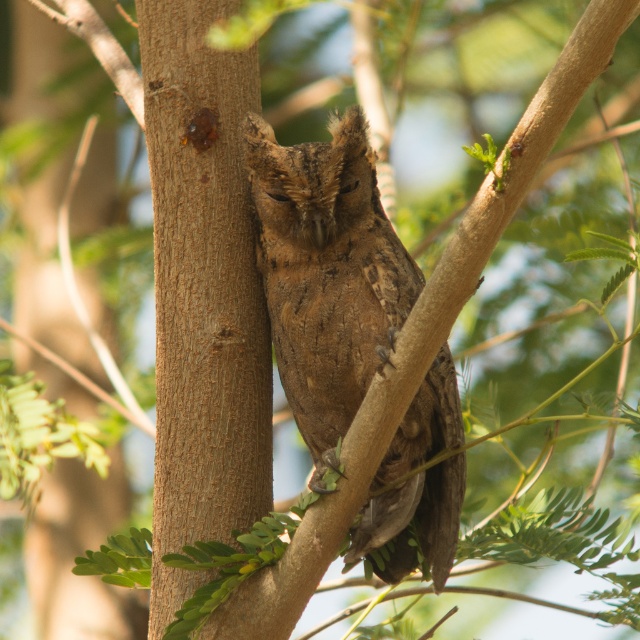
Between brown rough tree trunk at center and brown feathered owl at center, which one has less height?

brown feathered owl at center

Does brown rough tree trunk at center appear on the right side of brown feathered owl at center?

In fact, brown rough tree trunk at center is to the left of brown feathered owl at center.

This screenshot has width=640, height=640. Describe the element at coordinates (202, 292) in the screenshot. I see `brown rough tree trunk at center` at that location.

Where is `brown rough tree trunk at center`? brown rough tree trunk at center is located at coordinates (202, 292).